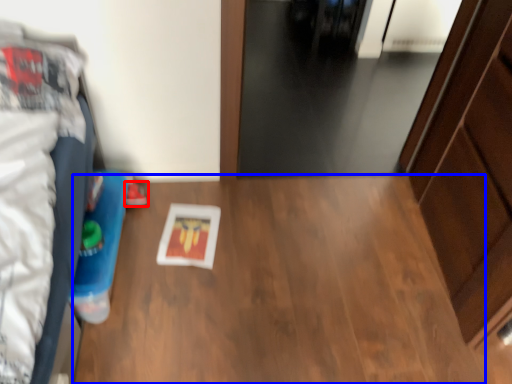
Question: Which object appears farthest to the camera in this image, footwear (highlighted by a red box) or table (highlighted by a blue box)?

Choices:
 (A) footwear
 (B) table

Answer: (A)